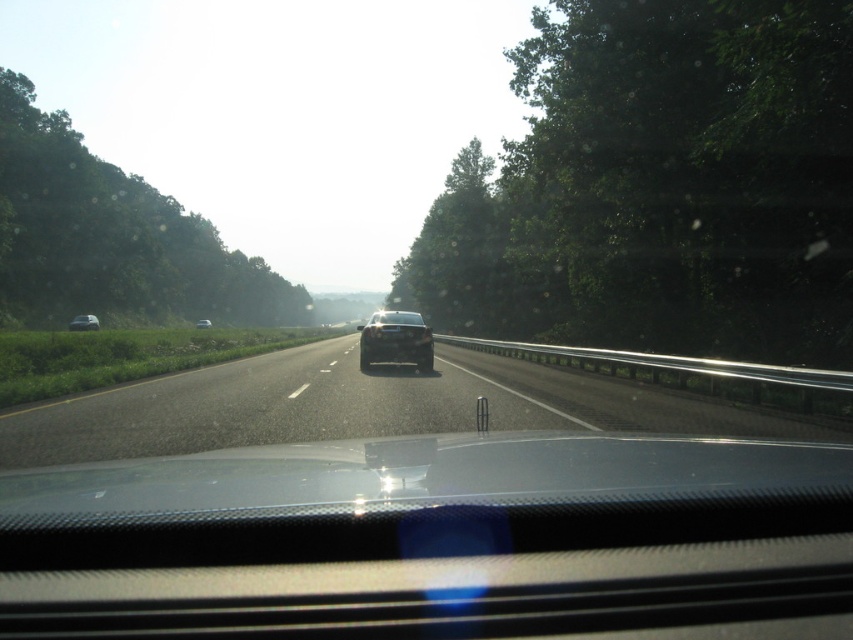
How far apart are satin black sedan at center and white glossy sedan at center?

satin black sedan at center and white glossy sedan at center are 257.42 feet apart from each other.

Which is in front, point (373, 342) or point (206, 320)?

Point (373, 342) is more forward.

Which is behind, point (376, 337) or point (204, 317)?

The point (204, 317) is more distant.

Find the location of a particular element. satin black sedan at center is located at coordinates (396, 340).

Who is lower down, metallic silver car at left or white glossy sedan at center?

white glossy sedan at center is lower down.

Does metallic silver car at left appear over white glossy sedan at center?

Yes, metallic silver car at left is above white glossy sedan at center.

Which is behind, point (78, 316) or point (200, 321)?

Positioned behind is point (200, 321).

The image size is (853, 640). What are the coordinates of `metallic silver car at left` in the screenshot? It's located at click(x=84, y=323).

Can you confirm if black asphalt highway at center is shorter than metallic silver car at left?

Yes, black asphalt highway at center is shorter than metallic silver car at left.

Measure the distance between black asphalt highway at center and metallic silver car at left.

A distance of 160.63 feet exists between black asphalt highway at center and metallic silver car at left.

This screenshot has width=853, height=640. Find the location of `black asphalt highway at center`. black asphalt highway at center is located at coordinates (369, 406).

Where is `black asphalt highway at center`? This screenshot has width=853, height=640. black asphalt highway at center is located at coordinates (369, 406).